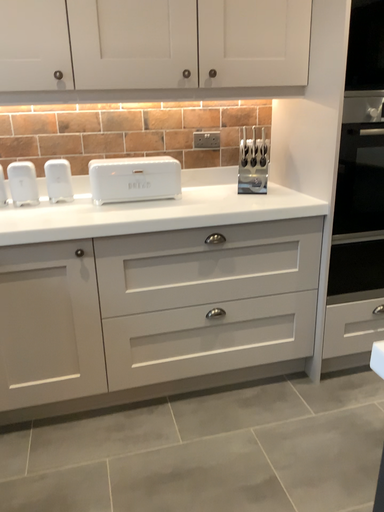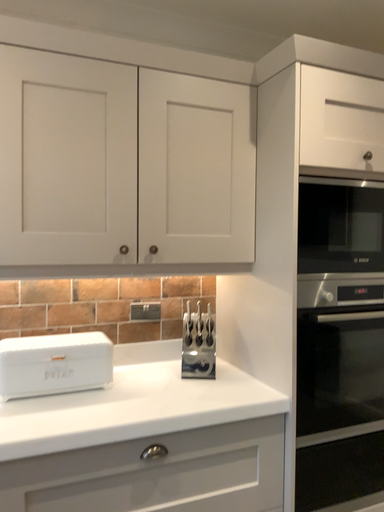
Question: Which way did the camera rotate in the video?

Choices:
 (A) rotated upward
 (B) rotated downward

Answer: (A)